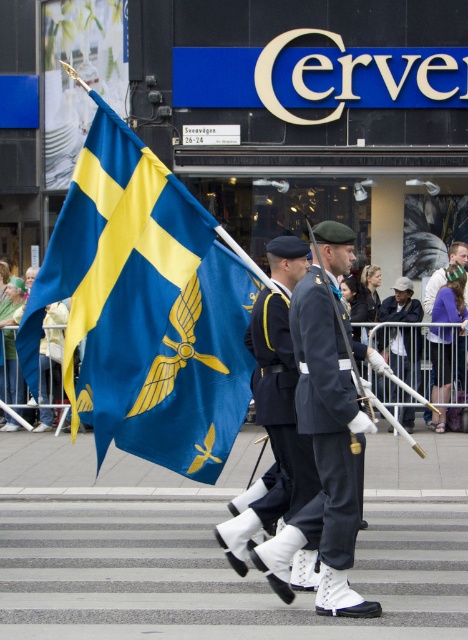
Question: Is dark blue fabric uniform at center smaller than white matte uniform at center?

Choices:
 (A) yes
 (B) no

Answer: (A)

Question: Observing the image, what is the correct spatial positioning of dark blue uniform at center in reference to white matte uniform at center?

Choices:
 (A) left
 (B) right

Answer: (A)

Question: Which of the following is the farthest from the observer?

Choices:
 (A) light brown leather jacket at center
 (B) blue fabric flag at left

Answer: (A)

Question: Estimate the real-world distances between objects in this image. Which object is closer to the light brown leather jacket at center?

Choices:
 (A) navy blue fabric uniform at center
 (B) blue fabric flag at left
 (C) dark blue fabric uniform at center
 (D) white matte uniform at center

Answer: (D)

Question: Can you confirm if dark blue fabric uniform at center is bigger than light brown leather jacket at center?

Choices:
 (A) no
 (B) yes

Answer: (A)

Question: Which of the following is the farthest from the observer?

Choices:
 (A) (409, 332)
 (B) (271, 376)
 (C) (138, 426)
 (D) (351, 522)

Answer: (A)